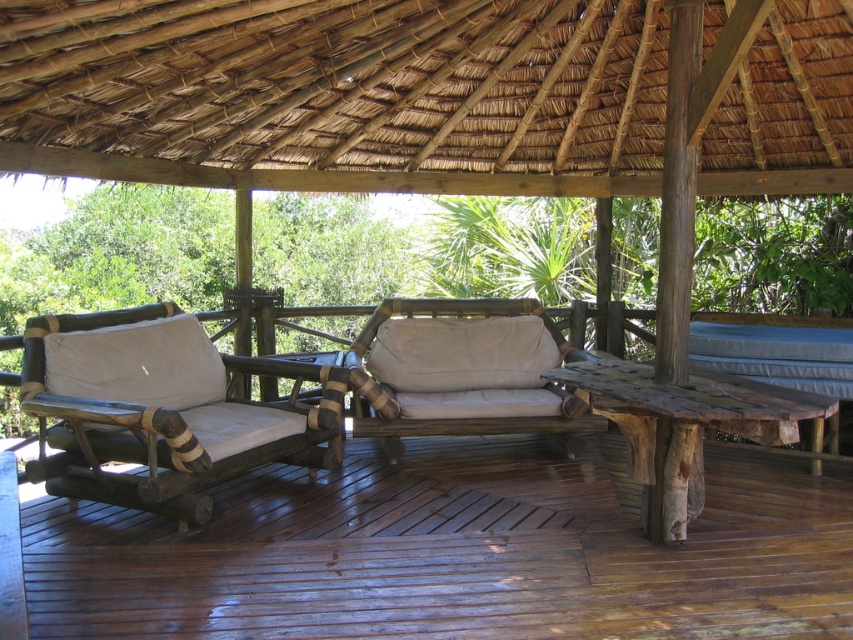
Which is in front, point (392, 609) or point (474, 365)?

Point (392, 609)

Who is lower down, brown wooden deck at center or beige fabric cushion at center?

Positioned lower is brown wooden deck at center.

Identify the location of brown wooden deck at center. (456, 552).

Which is behind, point (407, 388) or point (451, 365)?

The point (451, 365) is more distant.

Can you confirm if beige fabric couch at center is bigger than beige fabric cushion at center?

Indeed, beige fabric couch at center has a larger size compared to beige fabric cushion at center.

What are the coordinates of `beige fabric couch at center` in the screenshot? It's located at (461, 372).

The height and width of the screenshot is (640, 853). I want to click on beige fabric couch at center, so click(461, 372).

What do you see at coordinates (461, 372) in the screenshot? I see `beige fabric couch at center` at bounding box center [461, 372].

Is beige fabric couch at center closer to camera compared to blue fabric cushion at right?

That is False.

Where is `beige fabric couch at center`? The width and height of the screenshot is (853, 640). beige fabric couch at center is located at coordinates (461, 372).